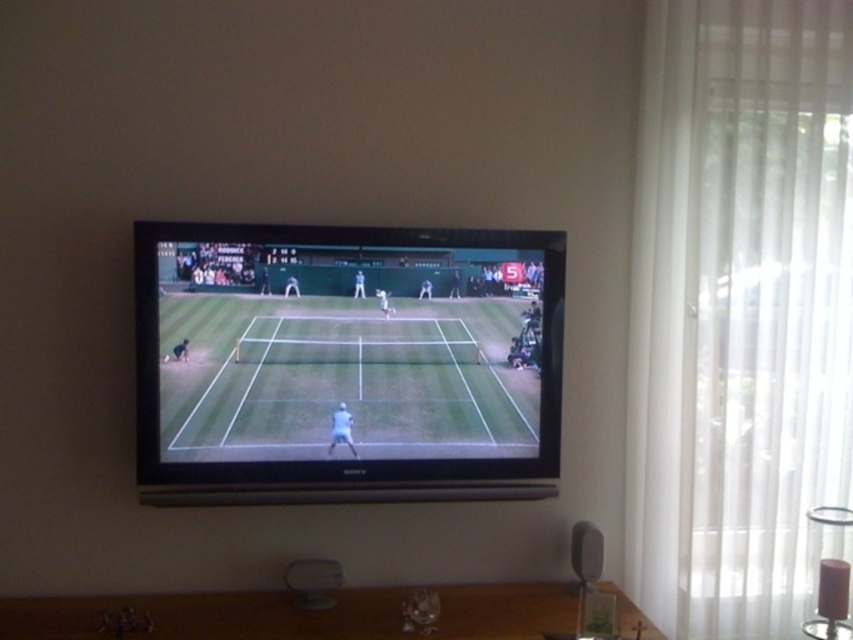
Question: Is white sheer curtain at right further to the viewer compared to green grass tennis court at center?

Choices:
 (A) no
 (B) yes

Answer: (B)

Question: Where is green grass tennis court at center located in relation to brown wooden table at lower center in the image?

Choices:
 (A) above
 (B) below

Answer: (A)

Question: Observing the image, what is the correct spatial positioning of white sheer curtain at right in reference to green grass tennis court at center?

Choices:
 (A) left
 (B) right

Answer: (B)

Question: Estimate the real-world distances between objects in this image. Which object is closer to the white sheer curtain at right?

Choices:
 (A) brown wooden table at lower center
 (B) green grass tennis court at center

Answer: (B)

Question: Which of these objects is positioned farthest from the green grass tennis court at center?

Choices:
 (A) white sheer curtain at right
 (B) brown wooden table at lower center

Answer: (A)

Question: Among these points, which one is farthest from the camera?

Choices:
 (A) (393, 401)
 (B) (332, 637)

Answer: (A)